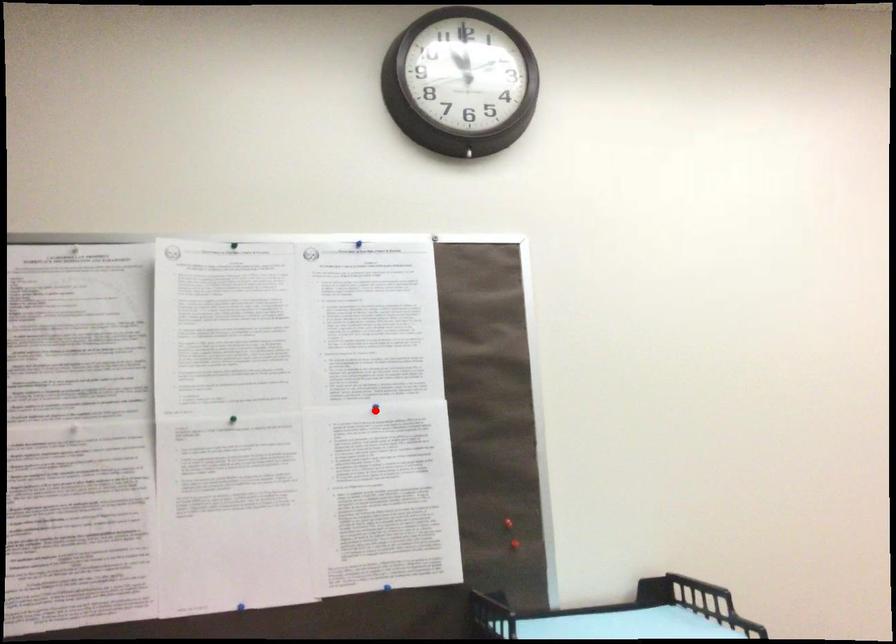
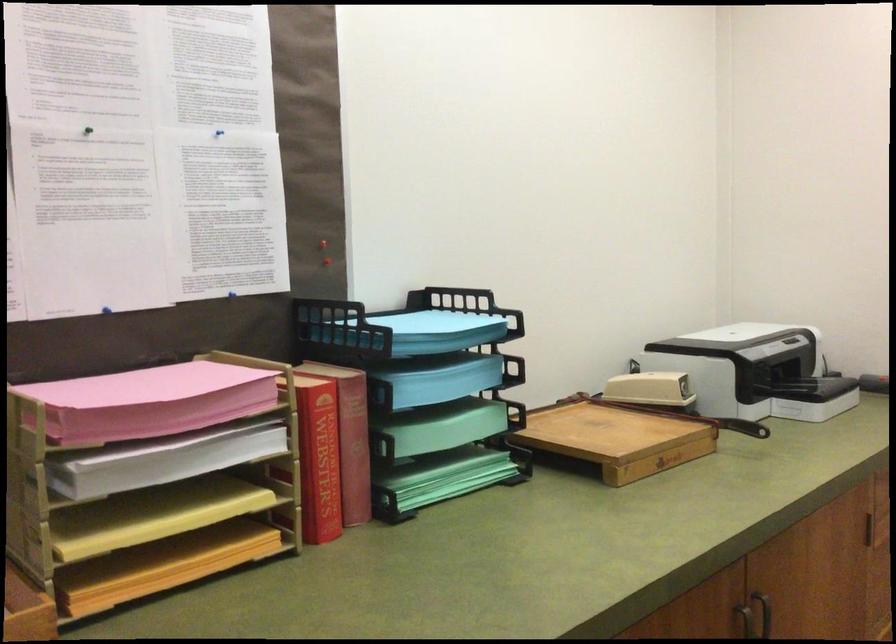
In the second image, find the point that corresponds to the highlighted location in the first image.

(218, 136)